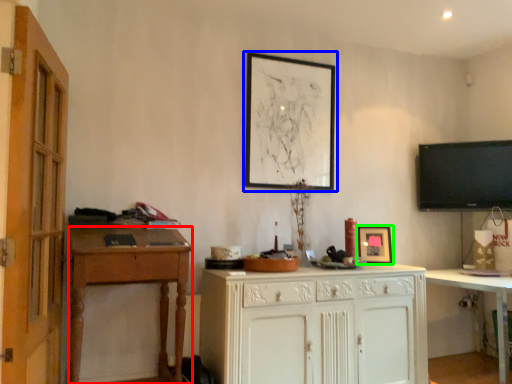
Question: Which object is positioned closest to desk (highlighted by a red box)? Select from picture frame (highlighted by a blue box) and picture frame (highlighted by a green box).

Choices:
 (A) picture frame
 (B) picture frame

Answer: (A)